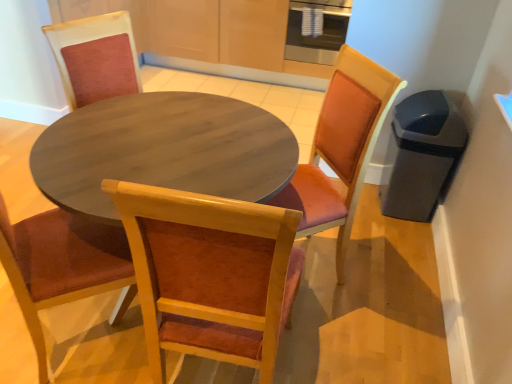
Locate an element on the screen. This screenshot has height=384, width=512. free spot to the right of wooden chair with orange cushion at center, positioned as the 2th chair in front-to-back order is located at coordinates (378, 281).